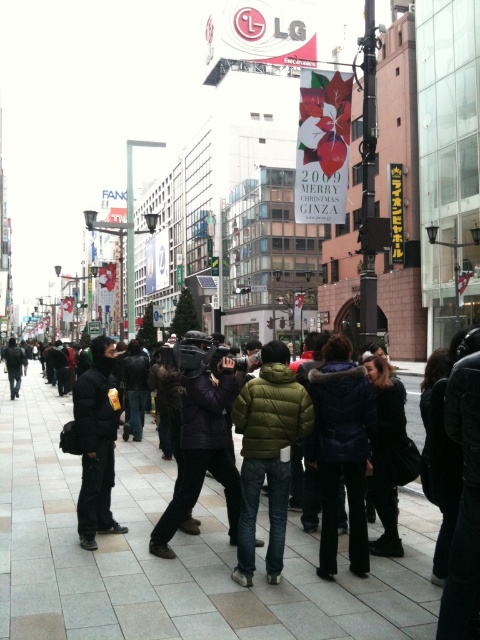
You are standing in the middle of the urban street scene in Ginza. There are two points marked in the image. Which point, point (x=248, y=433) or point (x=120, y=531), is closer to your current position?

Point (x=248, y=433) is closer to the camera than point (x=120, y=531), so it is closer to your current position.

You are standing on the gray concrete pavement at center and see the green down jacket at center. Which direction should you move to get closer to the jacket?

You should move to the right because the gray concrete pavement at center is to the left of the green down jacket at center, so moving right would bring you closer.

You are a photographer standing in the bustling urban street scene in Ginza. You have two jackets in view, the green down jacket at center and the dark green puffer jacket at left. Which jacket is wider?

The green down jacket at center is wider than the dark green puffer jacket at left.